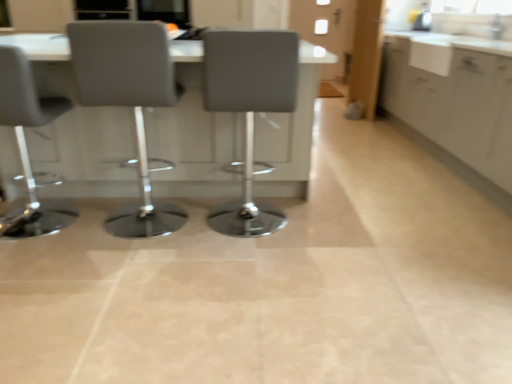
Question: Is matte black screen at upper center taller than white glossy countertop at upper right?

Choices:
 (A) yes
 (B) no

Answer: (A)

Question: Does matte black screen at upper center have a greater width compared to white glossy countertop at upper right?

Choices:
 (A) no
 (B) yes

Answer: (A)

Question: Is matte black screen at upper center shorter than white glossy countertop at upper right?

Choices:
 (A) no
 (B) yes

Answer: (A)

Question: From a real-world perspective, is matte black screen at upper center physically above white glossy countertop at upper right?

Choices:
 (A) no
 (B) yes

Answer: (B)

Question: Can you confirm if matte black screen at upper center is bigger than white glossy countertop at upper right?

Choices:
 (A) yes
 (B) no

Answer: (A)

Question: From the image's perspective, is matte gray chair at center, which appears as the 2th chair when viewed from the right, above or below white glossy table at center?

Choices:
 (A) below
 (B) above

Answer: (A)

Question: Is matte gray chair at center, acting as the 2th chair starting from the left, wider or thinner than white glossy table at center?

Choices:
 (A) thin
 (B) wide

Answer: (A)

Question: In terms of height, does matte gray chair at center, acting as the 2th chair starting from the left, look taller or shorter compared to white glossy table at center?

Choices:
 (A) short
 (B) tall

Answer: (B)

Question: Considering the positions of point pos(153,215) and point pos(71,150), is point pos(153,215) closer or farther from the camera than point pos(71,150)?

Choices:
 (A) closer
 (B) farther

Answer: (A)

Question: Do you think matte gray chair at center, which ranks as the 1th chair in right-to-left order, is within white glossy countertop at upper right, or outside of it?

Choices:
 (A) outside
 (B) inside

Answer: (A)

Question: From a real-world perspective, is matte gray chair at center, positioned as the third chair in left-to-right order, above or below white glossy countertop at upper right?

Choices:
 (A) above
 (B) below

Answer: (B)

Question: From the image's perspective, is matte gray chair at center, positioned as the third chair in left-to-right order, positioned above or below white glossy countertop at upper right?

Choices:
 (A) below
 (B) above

Answer: (A)

Question: Is matte gray chair at center, which ranks as the 1th chair in right-to-left order, in front of or behind white glossy countertop at upper right in the image?

Choices:
 (A) front
 (B) behind

Answer: (A)

Question: From a real-world perspective, relative to matte gray chair at left, the 1th chair viewed from the left, is white matte cabinet at right vertically above or below?

Choices:
 (A) below
 (B) above

Answer: (B)

Question: From the image's perspective, is white matte cabinet at right located above or below matte gray chair at left, the 1th chair viewed from the left?

Choices:
 (A) above
 (B) below

Answer: (A)